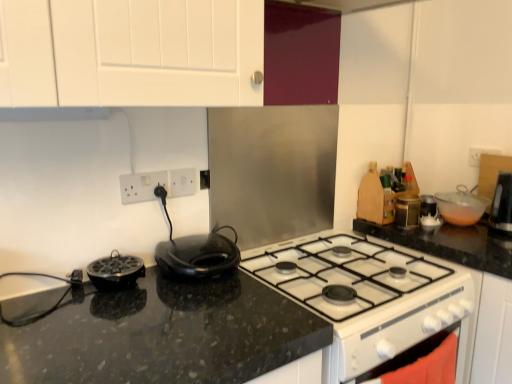
Question: Is the surface of black granite countertop at center in direct contact with white glossy oven at lower right?

Choices:
 (A) no
 (B) yes

Answer: (A)

Question: From the image's perspective, is black granite countertop at center beneath white glossy oven at lower right?

Choices:
 (A) no
 (B) yes

Answer: (A)

Question: Can you confirm if black granite countertop at center is positioned to the left of white glossy oven at lower right?

Choices:
 (A) no
 (B) yes

Answer: (B)

Question: Considering the relative sizes of black granite countertop at center and white glossy oven at lower right in the image provided, is black granite countertop at center shorter than white glossy oven at lower right?

Choices:
 (A) yes
 (B) no

Answer: (A)

Question: Is black granite countertop at center facing towards white glossy oven at lower right?

Choices:
 (A) yes
 (B) no

Answer: (B)

Question: Is point (190, 193) positioned closer to the camera than point (492, 331)?

Choices:
 (A) closer
 (B) farther

Answer: (A)

Question: From their relative heights in the image, would you say white plastic electric outlet at upper center, the 2th electric outlet viewed from the left, is taller or shorter than black granite countertop at center?

Choices:
 (A) short
 (B) tall

Answer: (A)

Question: Is white plastic electric outlet at upper center, the 2th electric outlet viewed from the left, wider or thinner than black granite countertop at center?

Choices:
 (A) wide
 (B) thin

Answer: (B)

Question: Choose the correct answer: Is white plastic electric outlet at upper center, marked as the 1th electric outlet in a right-to-left arrangement, inside black granite countertop at center or outside it?

Choices:
 (A) outside
 (B) inside

Answer: (A)

Question: In terms of height, does white plastic electric outlet at upper center, marked as the 1th electric outlet in a right-to-left arrangement, look taller or shorter compared to transparent plastic bowl at upper right, the first kitchen appliance in the back-to-front sequence?

Choices:
 (A) short
 (B) tall

Answer: (A)

Question: In the image, is white plastic electric outlet at upper center, the 2th electric outlet viewed from the left, on the left side or the right side of transparent plastic bowl at upper right, which ranks as the third kitchen appliance in left-to-right order?

Choices:
 (A) right
 (B) left

Answer: (B)

Question: Looking at their shapes, would you say white plastic electric outlet at upper center, marked as the 1th electric outlet in a right-to-left arrangement, is wider or thinner than transparent plastic bowl at upper right, which appears as the 3th kitchen appliance when viewed from the front?

Choices:
 (A) wide
 (B) thin

Answer: (B)

Question: Which is correct: white plastic electric outlet at upper center, the 2th electric outlet viewed from the left, is inside transparent plastic bowl at upper right, which appears as the 3th kitchen appliance when viewed from the front, or outside of it?

Choices:
 (A) outside
 (B) inside

Answer: (A)

Question: Visually, is black granite countertop at center positioned to the left or to the right of white plastic electrical outlet at center-left, the first electric outlet positioned from the left?

Choices:
 (A) left
 (B) right

Answer: (B)

Question: Is black granite countertop at center situated inside white plastic electrical outlet at center-left, the first electric outlet positioned from the left, or outside?

Choices:
 (A) inside
 (B) outside

Answer: (B)